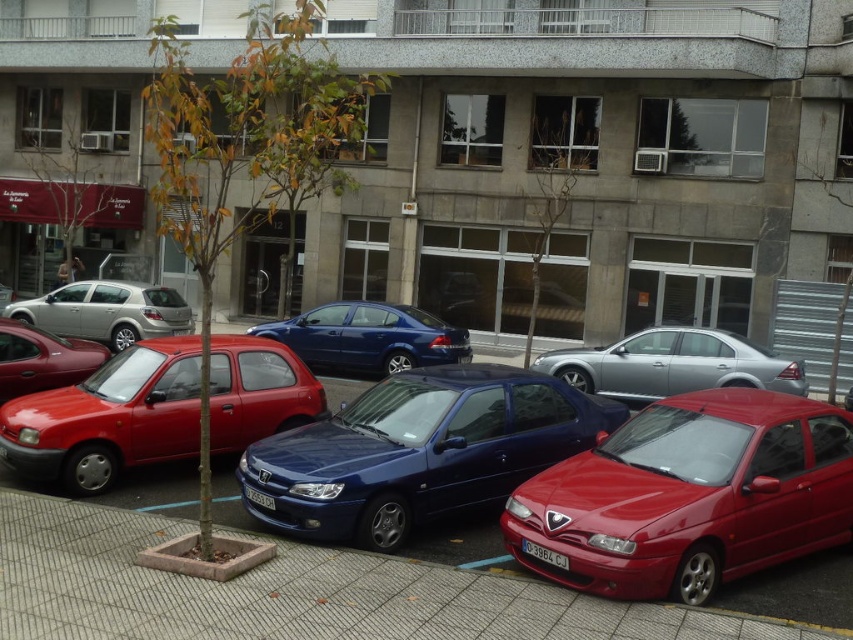
You are a delivery driver who needs to park your truck between the silver metallic sedan at center and the shiny red hatchback at left. Can you fit your truck there if the space between them is exactly 2 meters wide and your truck is 1.8 meters wide?

The space between the silver metallic sedan at center and the shiny red hatchback at left is exactly 2 meters wide. Since your truck is 1.8 meters wide, it can fit comfortably within the available space.